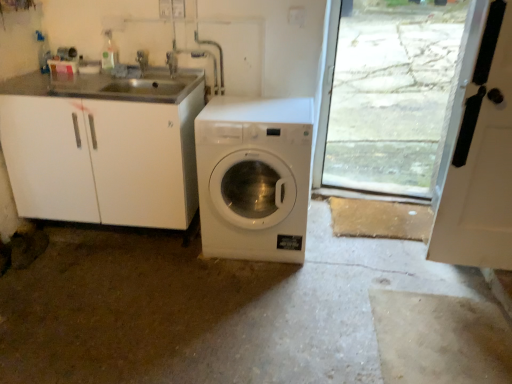
At what (x,y) coordinates should I click in order to perform the action: click on free point to the right of brushed metal faucet at upper center, the first faucet from the left. Please return your answer as a coordinate pair (x, y). The image size is (512, 384). Looking at the image, I should click on (165, 81).